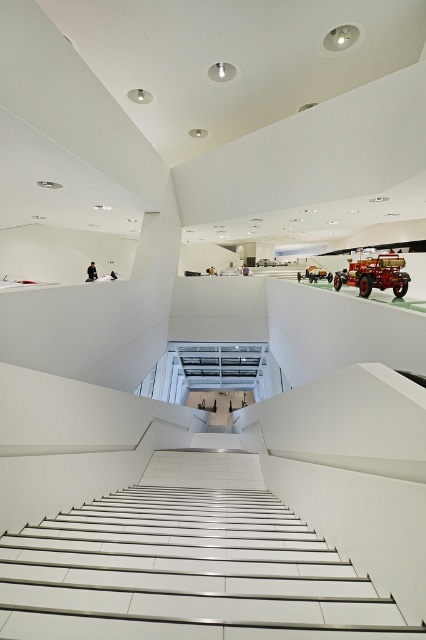
Question: Does white glossy stair at center appear on the left side of shiny red fire truck at upper center?

Choices:
 (A) yes
 (B) no

Answer: (A)

Question: Which point appears closest to the camera in this image?

Choices:
 (A) (313, 264)
 (B) (374, 266)
 (C) (16, 541)

Answer: (C)

Question: Which object is the farthest from the shiny red fire truck at upper center?

Choices:
 (A) white glossy stair at center
 (B) orange matte toy car at center

Answer: (A)

Question: Is white glossy stair at center closer to the viewer compared to orange matte toy car at center?

Choices:
 (A) no
 (B) yes

Answer: (B)

Question: Is white glossy stair at center bigger than orange matte toy car at center?

Choices:
 (A) yes
 (B) no

Answer: (B)

Question: Which object appears closest to the camera in this image?

Choices:
 (A) orange matte toy car at center
 (B) shiny red fire truck at upper center
 (C) white glossy stair at center

Answer: (C)